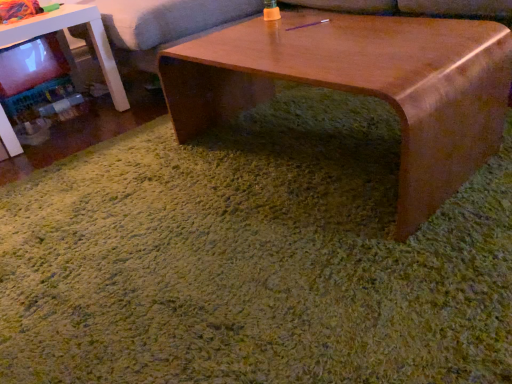
The height and width of the screenshot is (384, 512). I want to click on vacant space situated on the left part of wooden coffee table at center, so click(x=131, y=203).